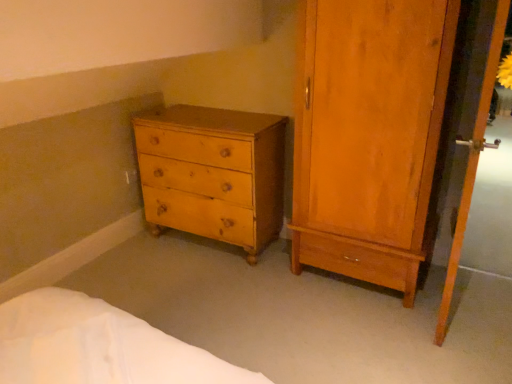
Find the location of a particular element. The height and width of the screenshot is (384, 512). vacant space in front of wooden screen door at right is located at coordinates (463, 349).